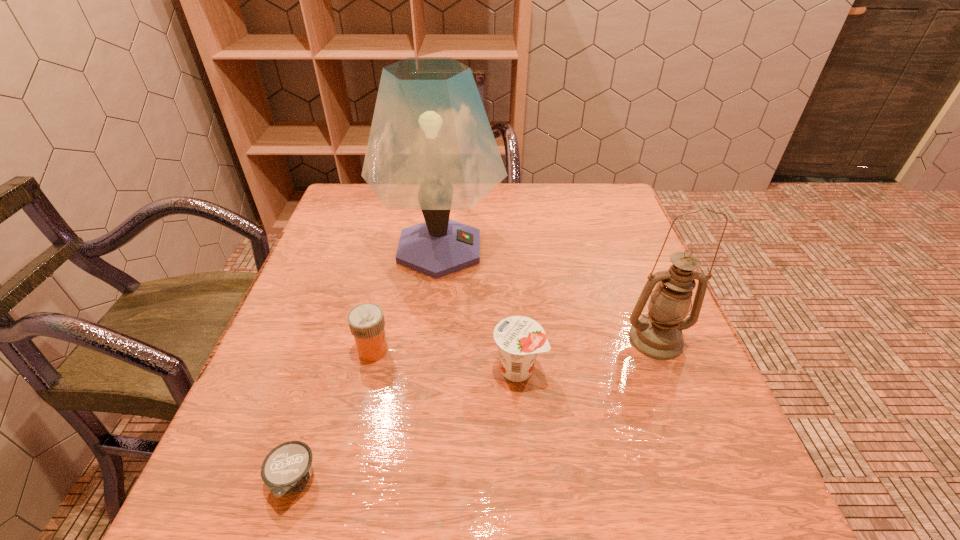
You are a GUI agent. You are given a task and a screenshot of the screen. Output one action in this format:
    pyautogui.click(x=<x>, y=<y>)
    Task: Click on the farthest object
    
    Given the screenshot: What is the action you would take?
    pyautogui.click(x=431, y=147)

The height and width of the screenshot is (540, 960). Identify the location of lampshade. (431, 147).

Identify the location of the fourth shortest object. (658, 335).

At what (x,y) coordinates should I click in order to perform the action: click on oil lamp. Please return your answer as a coordinate pair (x, y). This screenshot has width=960, height=540. Looking at the image, I should click on (658, 335).

This screenshot has height=540, width=960. I want to click on medicine, so click(366, 321).

This screenshot has width=960, height=540. Identify the location of the right yogurt. (519, 339).

Identify the location of the farther yogurt. The image size is (960, 540). (519, 339).

Find the location of a particular element. The image size is (960, 540). the nearest object is located at coordinates (287, 468).

Identify the location of the shorter yogurt. The height and width of the screenshot is (540, 960). (287, 468).

Find the location of `blank space located on the base of the tallest object`. blank space located on the base of the tallest object is located at coordinates (557, 248).